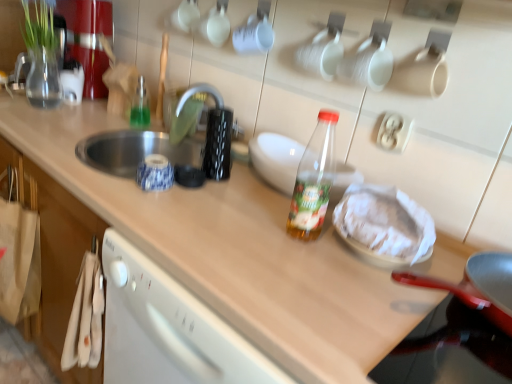
Measure the distance between transparent glass bottle at upper center, the 2th bottle positioned from the front, and camera.

transparent glass bottle at upper center, the 2th bottle positioned from the front, is 4.80 feet away from camera.

What is the approximate width of white fabric cabinet at lower left?

white fabric cabinet at lower left is 15.45 centimeters in width.

Describe the element at coordinates (56, 258) in the screenshot. Image resolution: width=512 pixels, height=384 pixels. I see `white fabric cabinet at lower left` at that location.

Describe the element at coordinates (276, 159) in the screenshot. The width and height of the screenshot is (512, 384). I see `transparent plastic bottle at center` at that location.

You are a GUI agent. You are given a task and a screenshot of the screen. Output one action in this format:
    pyautogui.click(x=<x>, y=<y>)
    Task: Click on the transparent glass bottle at upper center, which appears as the first bottle when viewed from the back
    The height and width of the screenshot is (384, 512).
    Given the screenshot: What is the action you would take?
    pyautogui.click(x=140, y=105)

Between point (270, 141) and point (69, 295), which one is positioned behind?

Point (69, 295)

Is transparent plastic bottle at center oriented towards white fabric cabinet at lower left?

No, transparent plastic bottle at center does not turn towards white fabric cabinet at lower left.

Where is `cabinetry on the left of transparent plastic bottle at center`? Image resolution: width=512 pixels, height=384 pixels. cabinetry on the left of transparent plastic bottle at center is located at coordinates (56, 258).

Is transparent plastic bottle at center at the right side of white fabric cabinet at lower left?

Correct, you'll find transparent plastic bottle at center to the right of white fabric cabinet at lower left.

Between white paper wrapped food at center and transparent glass bottle at upper center, the 2th bottle in the bottom-to-top sequence, which one is positioned in front?

white paper wrapped food at center is closer to the camera.

From the picture: Which of these two, white paper wrapped food at center or transparent glass bottle at upper center, the 2th bottle in the bottom-to-top sequence, stands shorter?

white paper wrapped food at center.

What's the angular difference between white paper wrapped food at center and transparent glass bottle at upper center, the 2th bottle positioned from the front,'s facing directions?

The angular difference between white paper wrapped food at center and transparent glass bottle at upper center, the 2th bottle positioned from the front, is 1.18 degrees.

From a real-world perspective, is white paper wrapped food at center physically above transparent glass bottle at upper center, the 2th bottle positioned from the front?

Yes, from a real-world perspective, white paper wrapped food at center is on top of transparent glass bottle at upper center, the 2th bottle positioned from the front.

Does point (27, 164) come in front of point (138, 85)?

Yes, it is.

Considering the relative positions of white fabric cabinet at lower left and transparent glass bottle at upper center, the 2th bottle in the bottom-to-top sequence, in the image provided, is white fabric cabinet at lower left to the right of transparent glass bottle at upper center, the 2th bottle in the bottom-to-top sequence, from the viewer's perspective?

No.

Does white fabric cabinet at lower left have a lesser width compared to transparent glass bottle at upper center, the 2th bottle positioned from the front?

Incorrect, the width of white fabric cabinet at lower left is not less than that of transparent glass bottle at upper center, the 2th bottle positioned from the front.

From the picture: From a real-world perspective, relative to transparent glass bottle at upper center, which ranks as the second bottle in right-to-left order, is white fabric cabinet at lower left vertically above or below?

From a real-world perspective, white fabric cabinet at lower left is physically below transparent glass bottle at upper center, which ranks as the second bottle in right-to-left order.

From a real-world perspective, is transparent glass bottle at upper center, which appears as the first bottle when viewed from the back, physically below white paper wrapped food at center?

Correct, in the physical world, transparent glass bottle at upper center, which appears as the first bottle when viewed from the back, is lower than white paper wrapped food at center.

From the image's perspective, is transparent glass bottle at upper center, which is the first bottle in top-to-bottom order, above white paper wrapped food at center?

Indeed, from the image's perspective, transparent glass bottle at upper center, which is the first bottle in top-to-bottom order, is shown above white paper wrapped food at center.

Considering the relative sizes of transparent glass bottle at upper center, which is the first bottle in left-to-right order, and white paper wrapped food at center in the image provided, is transparent glass bottle at upper center, which is the first bottle in left-to-right order, shorter than white paper wrapped food at center?

No.

Is white paper wrapped food at center at the back of transparent glass bottle at upper center, which is the first bottle in left-to-right order?

No, transparent glass bottle at upper center, which is the first bottle in left-to-right order, is not facing away from white paper wrapped food at center.

From a real-world perspective, between transparent glass bottle at upper center, the 2th bottle positioned from the front, and silver metallic faucet at upper center, who is vertically higher?

From a 3D spatial view, silver metallic faucet at upper center is above.

Between transparent glass bottle at upper center, which is the first bottle in left-to-right order, and silver metallic faucet at upper center, which one appears on the left side from the viewer's perspective?

Positioned to the left is transparent glass bottle at upper center, which is the first bottle in left-to-right order.

Would you say silver metallic faucet at upper center is part of transparent glass bottle at upper center, which is the first bottle in left-to-right order,'s contents?

No, silver metallic faucet at upper center is not surrounded by transparent glass bottle at upper center, which is the first bottle in left-to-right order.

Consider the image. Is the position of transparent glass bottle at upper center, which appears as the first bottle when viewed from the back, more distant than that of silver metallic faucet at upper center?

That is True.

Considering their positions, is silver metallic faucet at upper center located in front of or behind transparent glass bottle at upper center, which appears as the first bottle when viewed from the back?

In the image, silver metallic faucet at upper center appears in front of transparent glass bottle at upper center, which appears as the first bottle when viewed from the back.

Is transparent glass bottle at upper center, which is the first bottle in top-to-bottom order, at the back of silver metallic faucet at upper center?

No, transparent glass bottle at upper center, which is the first bottle in top-to-bottom order, is not at the back of silver metallic faucet at upper center.

Locate an element on the screen. bottle lying above the silver metallic faucet at upper center (from the image's perspective) is located at coordinates (140, 105).

Is transparent plastic bottle at center directly adjacent to silver metallic faucet at upper center?

No, transparent plastic bottle at center is not touching silver metallic faucet at upper center.

Is silver metallic faucet at upper center at the back of transparent plastic bottle at center?

transparent plastic bottle at center does not have its back to silver metallic faucet at upper center.

Which is in front, transparent plastic bottle at center or silver metallic faucet at upper center?

transparent plastic bottle at center.

Considering the positions of point (277, 175) and point (181, 130), is point (277, 175) closer or farther from the camera than point (181, 130)?

Point (277, 175) appears to be closer to the viewer than point (181, 130).

Locate an element on the screen. The width and height of the screenshot is (512, 384). cabinetry below the transparent plastic bottle at center (from the image's perspective) is located at coordinates (56, 258).

Image resolution: width=512 pixels, height=384 pixels. In the image, there is a white paper wrapped food at center. Identify the location of bottle below it (from a real-world perspective). (140, 105).

Looking at the image, which one is located further to transparent glass bottle at upper center, which ranks as the second bottle in right-to-left order, silver metallic faucet at upper center or transparent plastic bottle at center, arranged as the second bottle when viewed from the left?

transparent plastic bottle at center, arranged as the second bottle when viewed from the left.

When comparing their distances from white fabric cabinet at lower left, does transparent plastic bottle at center, arranged as the second bottle when viewed from the left, or silver metallic faucet at upper center seem further?

transparent plastic bottle at center, arranged as the second bottle when viewed from the left.

Based on their spatial positions, is white fabric cabinet at lower left or transparent plastic bottle at center, which ranks as the 1th bottle in right-to-left order, further from transparent plastic bottle at center?

Based on the image, white fabric cabinet at lower left appears to be further to transparent plastic bottle at center.

Estimate the real-world distances between objects in this image. Which object is further from transparent plastic bottle at center, acting as the 2th bottle starting from the back, white fabric cabinet at lower left or transparent glass bottle at upper center, which is the first bottle in top-to-bottom order?

transparent glass bottle at upper center, which is the first bottle in top-to-bottom order, is positioned further to the anchor transparent plastic bottle at center, acting as the 2th bottle starting from the back.

Looking at this image, looking at the image, which one is located closer to white fabric cabinet at lower left, transparent plastic bottle at center or white paper wrapped food at center?

transparent plastic bottle at center.

Looking at the image, which one is located closer to transparent plastic bottle at center, the 1th bottle ordered from the bottom, transparent glass bottle at upper center, the 2th bottle in the bottom-to-top sequence, or silver metallic faucet at upper center?

silver metallic faucet at upper center lies closer to transparent plastic bottle at center, the 1th bottle ordered from the bottom, than the other object.

From the image, which object appears to be nearer to transparent glass bottle at upper center, which is the first bottle in top-to-bottom order, white fabric cabinet at lower left or silver metallic faucet at upper center?

silver metallic faucet at upper center.

Based on their spatial positions, is silver metallic faucet at upper center or transparent glass bottle at upper center, which ranks as the second bottle in right-to-left order, closer to transparent plastic bottle at center?

silver metallic faucet at upper center.

You are a GUI agent. You are given a task and a screenshot of the screen. Output one action in this format:
    pyautogui.click(x=<x>, y=<y>)
    Task: Click on the appliance located between white paper wrapped food at center and silver metallic faucet at upper center in the depth direction
    The height and width of the screenshot is (384, 512).
    Given the screenshot: What is the action you would take?
    pyautogui.click(x=276, y=159)

Find the location of `bottle situated between transparent glass bottle at upper center, which ranks as the second bottle in right-to-left order, and white paper wrapped food at center from left to right`. bottle situated between transparent glass bottle at upper center, which ranks as the second bottle in right-to-left order, and white paper wrapped food at center from left to right is located at coordinates coord(314,180).

At what (x,y) coordinates should I click in order to perform the action: click on faucet located between transparent glass bottle at upper center, which appears as the first bottle when viewed from the back, and white paper wrapped food at center in the left-right direction. Please return your answer as a coordinate pair (x, y). Looking at the image, I should click on (206, 135).

At what (x,y) coordinates should I click in order to perform the action: click on appliance between white fabric cabinet at lower left and white paper wrapped food at center in the horizontal direction. Please return your answer as a coordinate pair (x, y). This screenshot has height=384, width=512. Looking at the image, I should click on (276, 159).